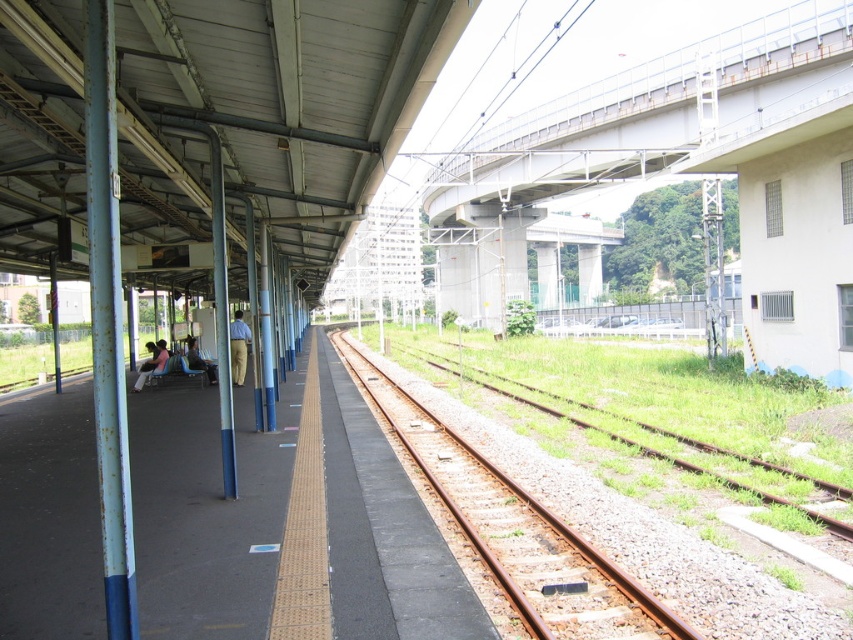
You are a maintenance worker who needs to cross from the light brown fabric chair at left to the brown gravel train track at center. Is the path between them wide enough for you to walk through comfortably?

The brown gravel train track at center might be wider than the light brown fabric chair at left, so the path between them could be wide enough for comfortable passage, but there is uncertainty due to the comparative description using the word

You are standing on the train station platform and see two points marked on the ground. The first point is at coordinate point (820, 486) and the second is at coordinate point (196, 349). If you face the direction of the tracks, which point is closer to you?

Point (820, 486) is in front of point (196, 349), so if you are facing the tracks, point (820, 486) is closer to you.

You are standing on the train station platform and see the brown gravel train track at center and the light brown fabric pants at center. Which object is closer to you?

The brown gravel train track at center is closer to you because it is in front of the light brown fabric pants at center.